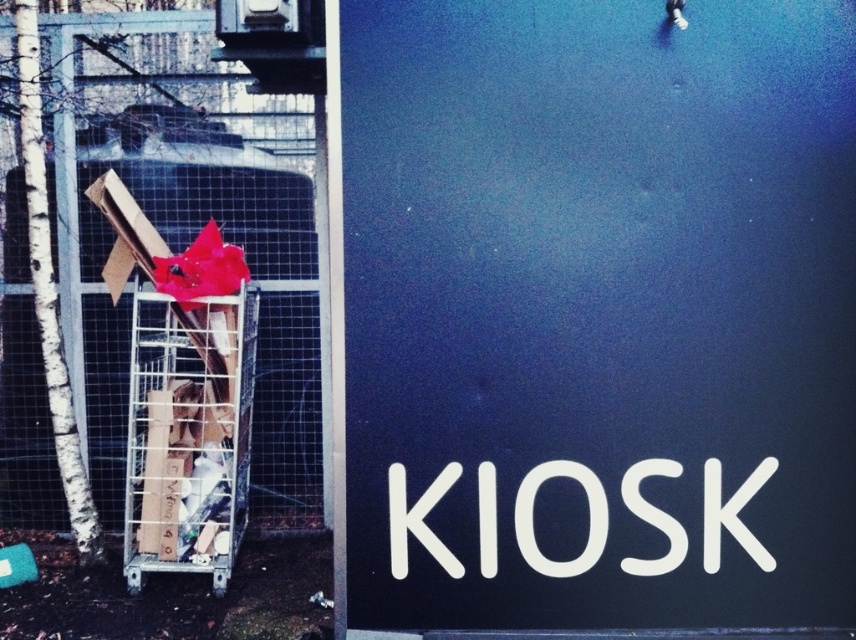
Question: Which object is the farthest from the black matte sign at center?

Choices:
 (A) metallic silver shopping cart at left
 (B) metal mesh fence at left

Answer: (B)

Question: Is metal mesh fence at left smaller than metallic silver shopping cart at left?

Choices:
 (A) yes
 (B) no

Answer: (B)

Question: Which of these objects is positioned farthest from the black matte sign at center?

Choices:
 (A) metallic silver shopping cart at left
 (B) metal mesh fence at left

Answer: (B)

Question: Can you confirm if metal mesh fence at left is bigger than metallic silver shopping cart at left?

Choices:
 (A) yes
 (B) no

Answer: (A)

Question: Which object is positioned closest to the black matte sign at center?

Choices:
 (A) metallic silver shopping cart at left
 (B) metal mesh fence at left

Answer: (A)

Question: Is black matte sign at center positioned before metal mesh fence at left?

Choices:
 (A) yes
 (B) no

Answer: (A)